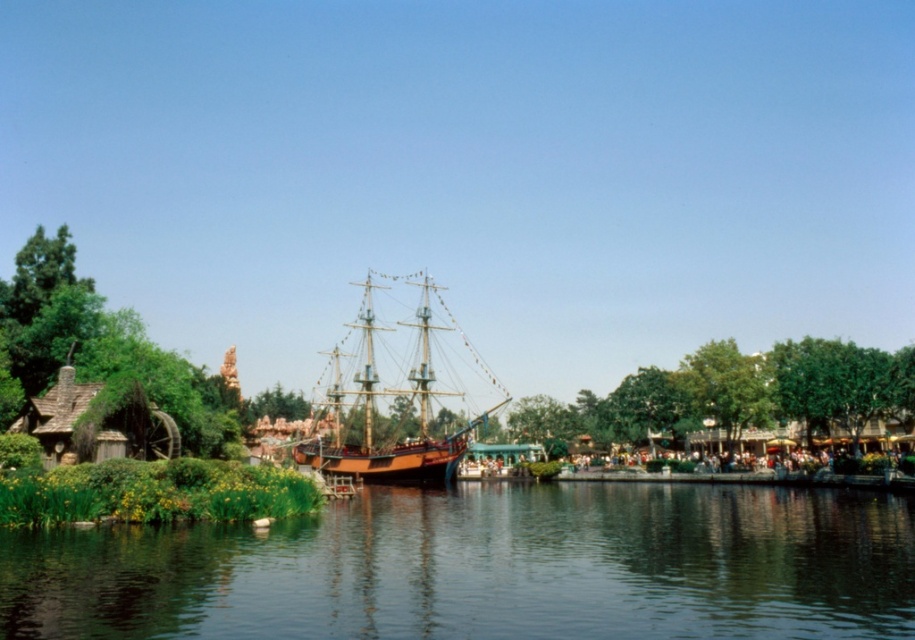
You are standing at the base of the ship and want to take a photo. You have two points marked on your camera screen, point 1 at coordinates point (526, 540) and point 2 at coordinates point (418, 483). Which point will appear larger in your photo?

Point (526, 540) is closer to the camera than point (418, 483), so it will appear larger in the photo.

You are standing on the dock and want to board the wooden ship at center. However, there is smooth dark water at center in your path. Which direction should you move to avoid it?

The smooth dark water at center is positioned on the right side of the wooden ship at center, so you should move to the left to avoid it and reach the wooden ship at center.

You are planning to build a small wooden dock for a boat. You have a limited amount of material and need to know which object in the scene takes up more space. Which one is larger between the smooth dark water at center and the wooden ship at center?

The wooden ship at center is larger because the smooth dark water at center occupies less space than the wooden ship at center.